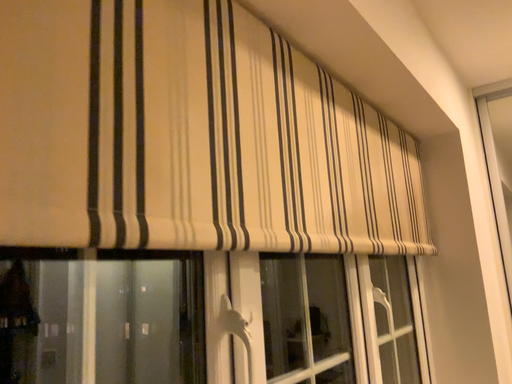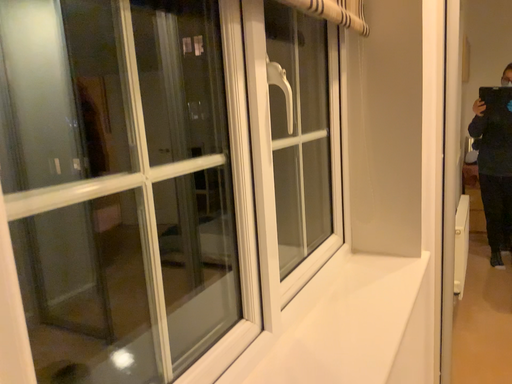
Question: How did the camera likely rotate when shooting the video?

Choices:
 (A) rotated upward
 (B) rotated downward

Answer: (B)